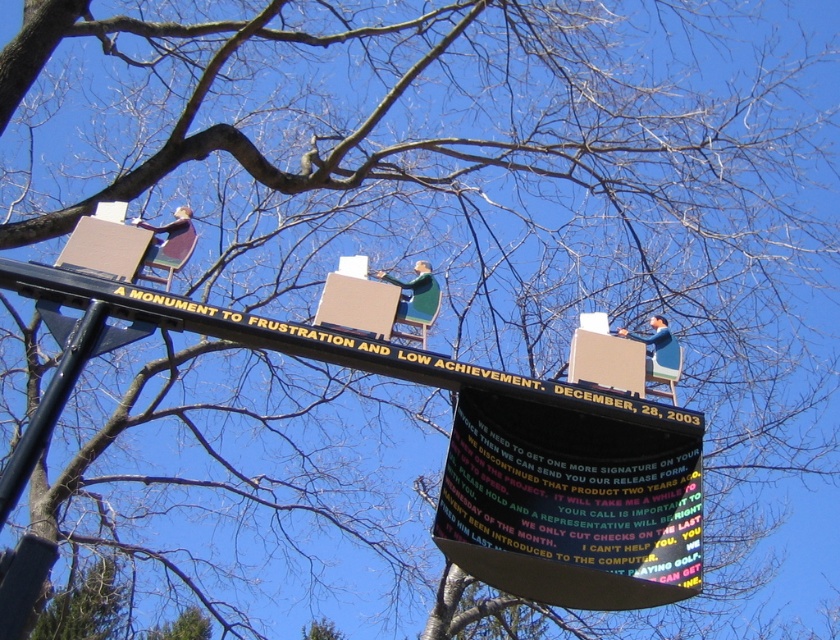
Question: Which point is closer to the camera?

Choices:
 (A) black plastic sign at center
 (B) black painted wood signboard at center

Answer: (A)

Question: Can you confirm if black plastic sign at center is positioned above black painted wood signboard at center?

Choices:
 (A) no
 (B) yes

Answer: (A)

Question: Does black plastic sign at center appear under black painted wood signboard at center?

Choices:
 (A) no
 (B) yes

Answer: (B)

Question: Which point is closer to the camera?

Choices:
 (A) (231, 316)
 (B) (683, 588)

Answer: (B)

Question: Is black plastic sign at center above black painted wood signboard at center?

Choices:
 (A) no
 (B) yes

Answer: (A)